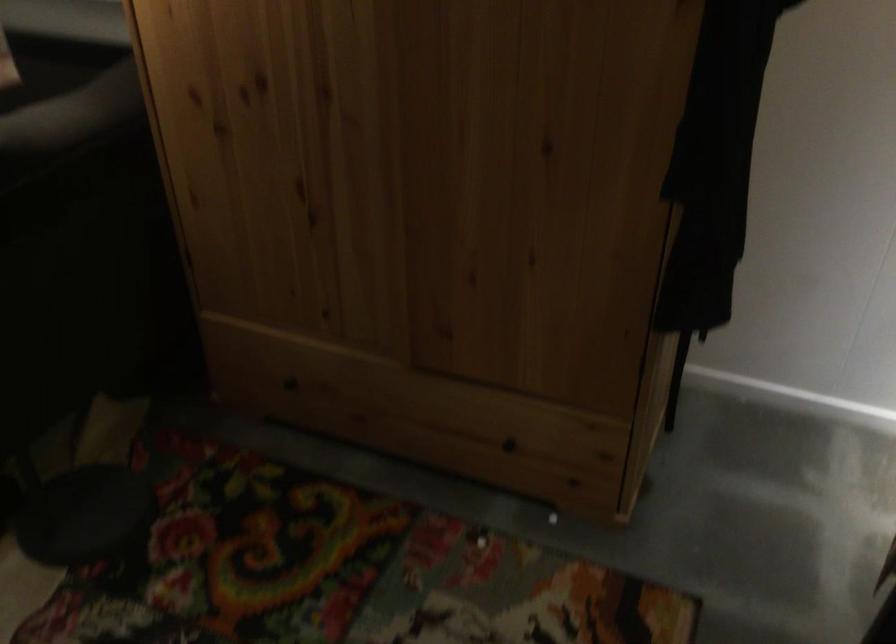
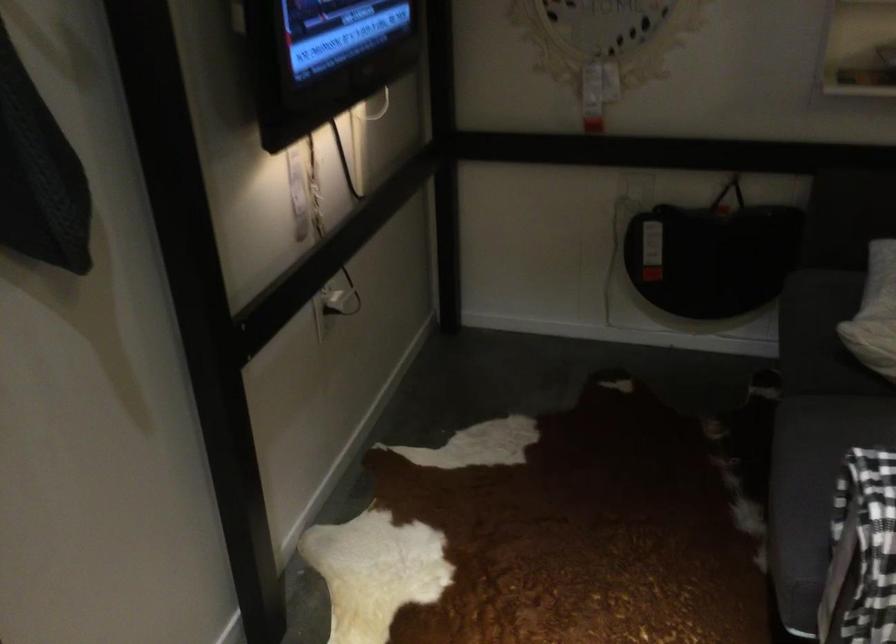
Question: In a continuous first-person perspective shot, in which direction is the camera moving?

Choices:
 (A) Left
 (B) Right
 (C) Forward
 (D) Backward

Answer: (A)